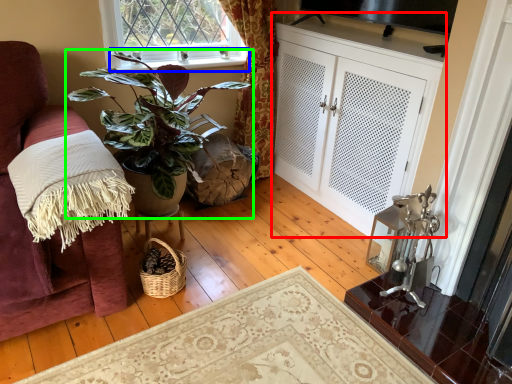
Question: Estimate the real-world distances between objects in this image. Which object is farther from cabinetry (highlighted by a red box), window sill (highlighted by a blue box) or houseplant (highlighted by a green box)?

Choices:
 (A) window sill
 (B) houseplant

Answer: (B)